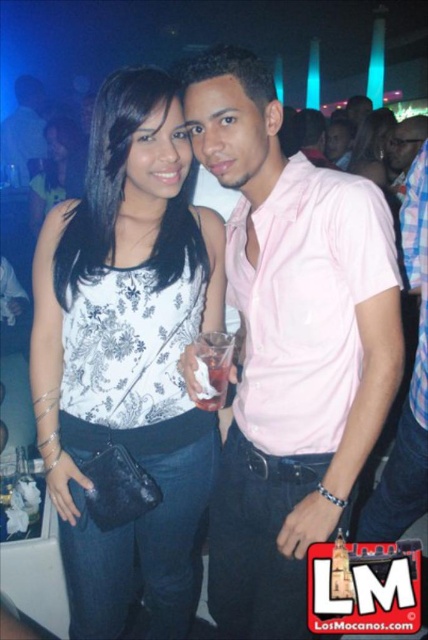
You are a photographer trying to capture the perfect shot of the white printed tank top at center. According to the coordinates given, where should you aim your camera to ensure the tank top is centered in the frame?

The white printed tank top at center is located at coordinates point (127, 355), so you should aim your camera at that point to center it in the frame.

You are at a party and want to grab the white paper cup at center without spilling its contents. Considering the pink matte shirt at center is in the way, can you reach the cup easily?

The white paper cup at center is positioned under the pink matte shirt at center, so you can reach it easily by moving your hand under the shirt without disturbing it.

You are a photographer standing 3 meters away from the scene. You want to capture a photo where both the white printed tank top at center and the matte black purse at center are in focus. Given that your camera can focus on objects within a 1.5 meter range, will you be able to achieve this?

The distance between the white printed tank top at center and the matte black purse at center is 2.06 meters, which exceeds the camera focus range of 1.5 meters. Therefore, you cannot have both in focus simultaneously.